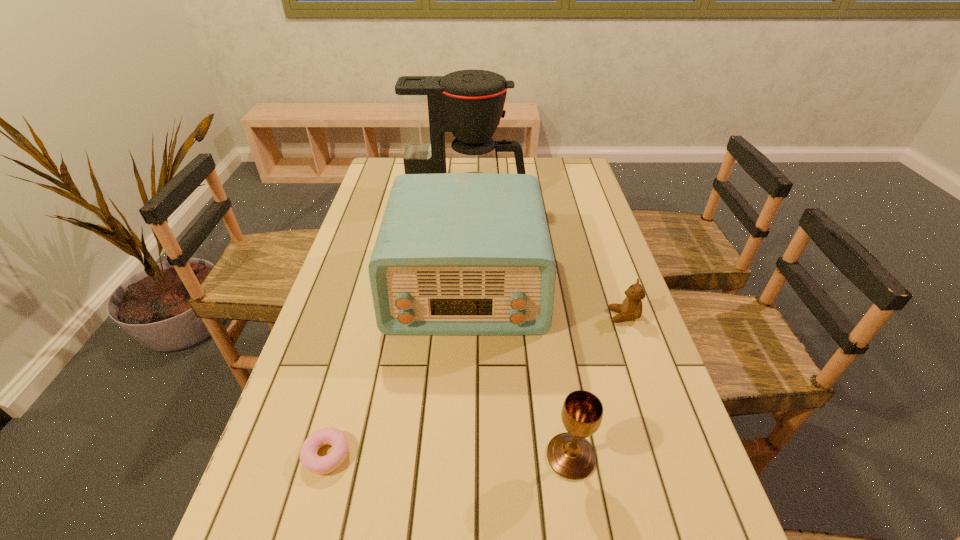
Image resolution: width=960 pixels, height=540 pixels. Find the location of `coffee maker`. coffee maker is located at coordinates (469, 103).

Identify the location of the tallest object. Image resolution: width=960 pixels, height=540 pixels. (469, 103).

You are a GUI agent. You are given a task and a screenshot of the screen. Output one action in this format:
    pyautogui.click(x=<x>, y=<y>)
    Task: Click on the radio receiver
    
    Given the screenshot: What is the action you would take?
    point(457,254)

The image size is (960, 540). Find the location of `chalice`. chalice is located at coordinates (570, 455).

The width and height of the screenshot is (960, 540). I want to click on the rightmost object, so click(x=631, y=308).

The height and width of the screenshot is (540, 960). I want to click on teddy bear, so click(631, 308).

I want to click on doughnut, so click(x=321, y=465).

Image resolution: width=960 pixels, height=540 pixels. I want to click on the leftmost object, so click(321, 465).

Identify the location of vacant region located pour from the carafe of the farthest object. This screenshot has height=540, width=960. (574, 198).

Find the location of a particular element. vacant space situated on the front panel of the second tallest object is located at coordinates (462, 410).